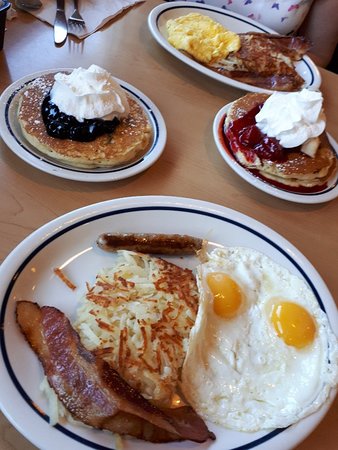
This screenshot has width=338, height=450. I want to click on napkin, so click(108, 15).